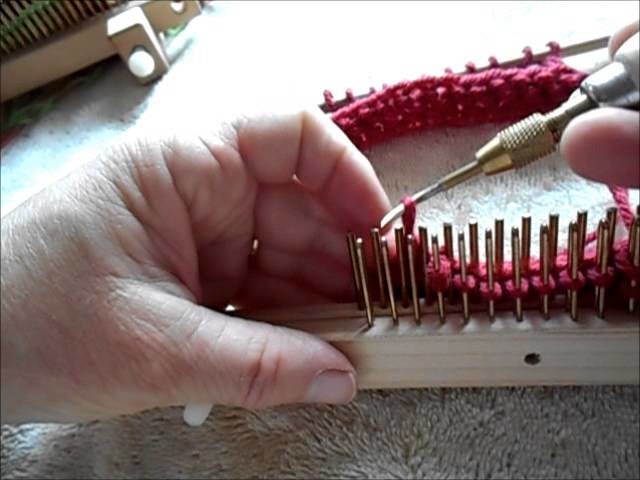
Find the location of a particular element. This screenshot has height=480, width=640. carpet is located at coordinates coord(396,449).